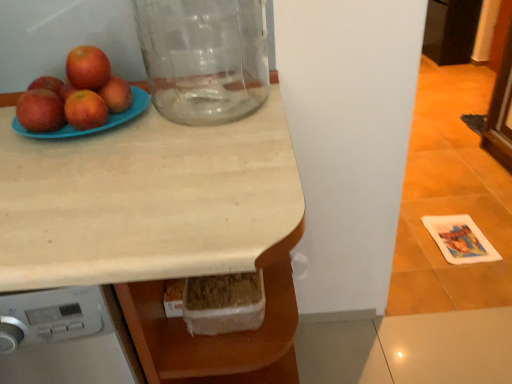
How much space does matte red apple at upper left, placed as the first apple when sorted from right to left, occupy horizontally?

The width of matte red apple at upper left, placed as the first apple when sorted from right to left, is 2.62 inches.

What do you see at coordinates (204, 57) in the screenshot? I see `transparent glass jar at upper left` at bounding box center [204, 57].

Image resolution: width=512 pixels, height=384 pixels. Describe the element at coordinates (40, 111) in the screenshot. I see `glossy red apple at left, which is the first apple from left to right` at that location.

What are the coordinates of `matte blue plate at upper left` in the screenshot? It's located at (94, 128).

Is transparent glass jar at upper left positioned beyond the bounds of matte blue plate at upper left?

transparent glass jar at upper left is positioned outside matte blue plate at upper left.

Which object is thinner, transparent glass jar at upper left or matte blue plate at upper left?

Thinner between the two is transparent glass jar at upper left.

Consider the image. From a real-world perspective, relative to matte blue plate at upper left, is transparent glass jar at upper left vertically above or below?

transparent glass jar at upper left is above matte blue plate at upper left.

Can you confirm if transparent glass jar at upper left is positioned to the right of matte blue plate at upper left?

Correct, you'll find transparent glass jar at upper left to the right of matte blue plate at upper left.

Is point (87, 117) less distant than point (132, 114)?

Yes, point (87, 117) is in front of point (132, 114).

Is shiny red apple at left, the 2th apple from the right, looking in the opposite direction of matte blue plate at upper left?

That's right, shiny red apple at left, the 2th apple from the right, is facing away from matte blue plate at upper left.

Which is more to the right, shiny red apple at left, acting as the 3th apple starting from the left, or matte blue plate at upper left?

Positioned to the right is shiny red apple at left, acting as the 3th apple starting from the left.

From the image's perspective, is shiny red apple at left, acting as the 3th apple starting from the left, below matte blue plate at upper left?

Correct, shiny red apple at left, acting as the 3th apple starting from the left, appears lower than matte blue plate at upper left in the image.

From the picture: Is shiny red apple at upper left, the second apple viewed from the left, surrounded by matte red apple at upper left, placed as the first apple when sorted from right to left?

No, shiny red apple at upper left, the second apple viewed from the left, is not a part of matte red apple at upper left, placed as the first apple when sorted from right to left.

From the image's perspective, which one is positioned lower, matte red apple at upper left, which is the fourth apple from left to right, or shiny red apple at upper left, the second apple viewed from the left?

matte red apple at upper left, which is the fourth apple from left to right, is shown below in the image.

Are matte red apple at upper left, placed as the first apple when sorted from right to left, and shiny red apple at upper left, the second apple viewed from the left, far apart?

No, there isn't a large distance between matte red apple at upper left, placed as the first apple when sorted from right to left, and shiny red apple at upper left, the second apple viewed from the left.

How much distance is there between matte red apple at upper left, which is the fourth apple from left to right, and shiny red apple at upper left, placed as the third apple when sorted from right to left?

matte red apple at upper left, which is the fourth apple from left to right, is 1.72 inches away from shiny red apple at upper left, placed as the third apple when sorted from right to left.

Does point (93, 83) come closer to viewer compared to point (110, 90)?

Yes, point (93, 83) is in front of point (110, 90).

From a real-world perspective, between shiny red apple at upper left, the second apple viewed from the left, and matte red apple at upper left, which is the fourth apple from left to right, who is vertically higher?

shiny red apple at upper left, the second apple viewed from the left, is physically above.

Is the surface of shiny red apple at upper left, the second apple viewed from the left, in direct contact with matte red apple at upper left, which is the fourth apple from left to right?

Yes, shiny red apple at upper left, the second apple viewed from the left, is beside matte red apple at upper left, which is the fourth apple from left to right.

Which object is closer to the camera taking this photo, shiny red apple at upper left, the second apple viewed from the left, or matte red apple at upper left, which is the fourth apple from left to right?

Positioned in front is shiny red apple at upper left, the second apple viewed from the left.

From the image's perspective, is shiny red apple at upper left, placed as the third apple when sorted from right to left, under shiny red apple at left, acting as the 3th apple starting from the left?

Actually, shiny red apple at upper left, placed as the third apple when sorted from right to left, appears above shiny red apple at left, acting as the 3th apple starting from the left, in the image.

Is point (75, 82) closer or farther from the camera than point (96, 118)?

Point (75, 82).

Find the location of a particular element. The height and width of the screenshot is (384, 512). the 3rd apple below the shiny red apple at upper left, the second apple viewed from the left (from the image's perspective) is located at coordinates click(85, 110).

Is shiny red apple at upper left, the second apple viewed from the left, inside or outside of shiny red apple at left, acting as the 3th apple starting from the left?

shiny red apple at upper left, the second apple viewed from the left, is outside shiny red apple at left, acting as the 3th apple starting from the left.

The width and height of the screenshot is (512, 384). There is a shiny red apple at left, acting as the 3th apple starting from the left. Identify the location of the 2nd apple above it (from the image's perspective). (116, 94).

Is shiny red apple at left, acting as the 3th apple starting from the left, shorter than matte red apple at upper left, placed as the first apple when sorted from right to left?

No, shiny red apple at left, acting as the 3th apple starting from the left, is not shorter than matte red apple at upper left, placed as the first apple when sorted from right to left.

Who is bigger, shiny red apple at left, the 2th apple from the right, or matte red apple at upper left, placed as the first apple when sorted from right to left?

matte red apple at upper left, placed as the first apple when sorted from right to left.

Which of these two, transparent glass jar at upper left or shiny red apple at upper left, the second apple viewed from the left, is wider?

With larger width is transparent glass jar at upper left.

From the picture: Does transparent glass jar at upper left turn towards shiny red apple at upper left, placed as the third apple when sorted from right to left?

No, transparent glass jar at upper left is not turned towards shiny red apple at upper left, placed as the third apple when sorted from right to left.

Can shiny red apple at upper left, the second apple viewed from the left, be found inside transparent glass jar at upper left?

No, transparent glass jar at upper left does not contain shiny red apple at upper left, the second apple viewed from the left.

You are a GUI agent. You are given a task and a screenshot of the screen. Output one action in this format:
    pyautogui.click(x=<x>, y=<y>)
    Task: Click on the glass jar above the matte blue plate at upper left (from the image's perspective)
    The width and height of the screenshot is (512, 384).
    Given the screenshot: What is the action you would take?
    pyautogui.click(x=204, y=57)

In order to click on glass plate below the shiny red apple at left, the 2th apple from the right (from a real-world perspective) in this screenshot , I will do `click(94, 128)`.

Which object lies further to the anchor point light wood countertop at center, matte red apple at upper left, placed as the first apple when sorted from right to left, or matte blue plate at upper left?

matte red apple at upper left, placed as the first apple when sorted from right to left.

From the image, which object appears to be nearer to shiny red apple at left, the 2th apple from the right, matte blue plate at upper left or transparent glass jar at upper left?

matte blue plate at upper left is positioned closer to the anchor shiny red apple at left, the 2th apple from the right.

Which object lies further to the anchor point transparent glass jar at upper left, shiny red apple at left, acting as the 3th apple starting from the left, or matte red apple at upper left, placed as the first apple when sorted from right to left?

shiny red apple at left, acting as the 3th apple starting from the left, is positioned further to the anchor transparent glass jar at upper left.

Which object lies further to the anchor point shiny red apple at left, acting as the 3th apple starting from the left, matte red apple at upper left, placed as the first apple when sorted from right to left, or glossy red apple at left, which is the first apple from left to right?

Based on the image, matte red apple at upper left, placed as the first apple when sorted from right to left, appears to be further to shiny red apple at left, acting as the 3th apple starting from the left.

When comparing their distances from shiny red apple at upper left, placed as the third apple when sorted from right to left, does light wood countertop at center or transparent glass jar at upper left seem further?

light wood countertop at center is further to shiny red apple at upper left, placed as the third apple when sorted from right to left.

Estimate the real-world distances between objects in this image. Which object is closer to matte blue plate at upper left, shiny red apple at left, the 2th apple from the right, or shiny red apple at upper left, placed as the third apple when sorted from right to left?

shiny red apple at left, the 2th apple from the right, lies closer to matte blue plate at upper left than the other object.

Which object lies nearer to the anchor point light wood countertop at center, matte blue plate at upper left or glossy red apple at left, which is the first apple from left to right?

matte blue plate at upper left is closer to light wood countertop at center.

Considering their positions, is shiny red apple at upper left, the second apple viewed from the left, positioned further to shiny red apple at left, acting as the 3th apple starting from the left, than transparent glass jar at upper left?

The object further to shiny red apple at left, acting as the 3th apple starting from the left, is transparent glass jar at upper left.

The image size is (512, 384). Find the location of `glass plate between glossy red apple at left, which is the first apple from left to right, and shiny red apple at left, the 2th apple from the right, in the horizontal direction`. glass plate between glossy red apple at left, which is the first apple from left to right, and shiny red apple at left, the 2th apple from the right, in the horizontal direction is located at coordinates (94, 128).

Image resolution: width=512 pixels, height=384 pixels. In order to click on apple between shiny red apple at left, acting as the 3th apple starting from the left, and transparent glass jar at upper left, in the horizontal direction in this screenshot , I will do `click(116, 94)`.

At what (x,y) coordinates should I click in order to perform the action: click on glass plate located between glossy red apple at left, marked as the fourth apple in a right-to-left arrangement, and matte red apple at upper left, placed as the first apple when sorted from right to left, in the left-right direction. Please return your answer as a coordinate pair (x, y). The width and height of the screenshot is (512, 384). Looking at the image, I should click on (94, 128).

Where is `glass plate between glossy red apple at left, which is the first apple from left to right, and transparent glass jar at upper left, in the horizontal direction`? The width and height of the screenshot is (512, 384). glass plate between glossy red apple at left, which is the first apple from left to right, and transparent glass jar at upper left, in the horizontal direction is located at coordinates (94, 128).